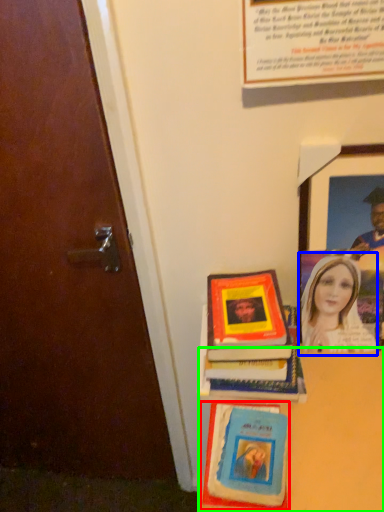
Question: Estimate the real-world distances between objects in this image. Which object is farther from book cover (highlighted by a red box), woman (highlighted by a blue box) or table (highlighted by a green box)?

Choices:
 (A) woman
 (B) table

Answer: (A)